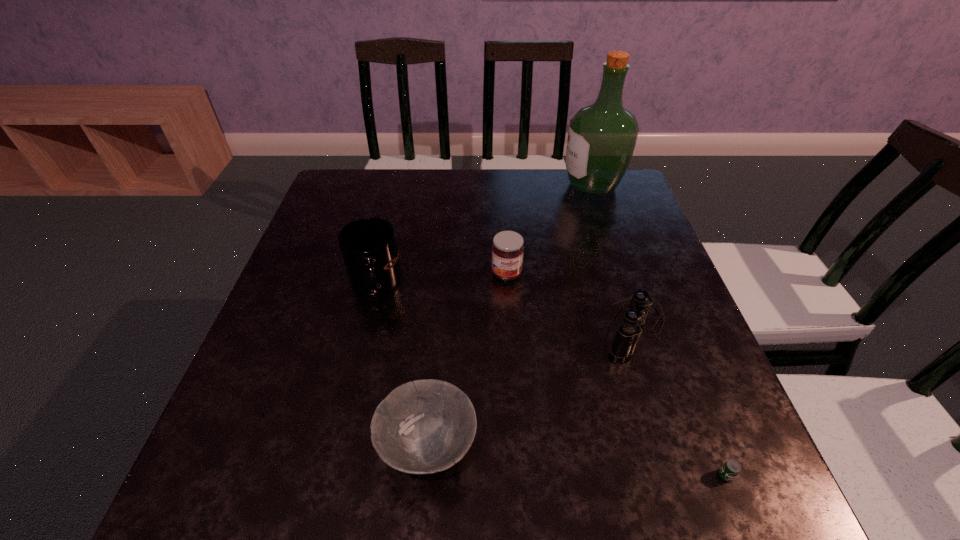
Locate an element on the screen. Image resolution: width=960 pixels, height=540 pixels. object that stands as the fifth closest to the tallest object is located at coordinates (731, 468).

Locate an element on the screen. vacant area in the image that satisfies the following two spatial constraints: 1. on the front-facing side of the tallest object; 2. on the front side of the third object from left to right is located at coordinates pyautogui.click(x=621, y=273).

Identify the location of vacant space that satisfies the following two spatial constraints: 1. with the handle on the side of the fifth shortest object; 2. on the left side of the shortest object. (328, 475).

Locate an element on the screen. This screenshot has width=960, height=540. vacant space that satisfies the following two spatial constraints: 1. on the front side of the fifth tallest object; 2. on the left side of the shortest object is located at coordinates (425, 475).

Where is `vacant region that satisfies the following two spatial constraints: 1. with the handle on the side of the mug; 2. on the left side of the fifth object from right to left`? Image resolution: width=960 pixels, height=540 pixels. vacant region that satisfies the following two spatial constraints: 1. with the handle on the side of the mug; 2. on the left side of the fifth object from right to left is located at coordinates (336, 447).

Image resolution: width=960 pixels, height=540 pixels. I want to click on free space that satisfies the following two spatial constraints: 1. on the front side of the bowl; 2. on the right side of the shortest object, so point(425,475).

Where is `free spot that satisfies the following two spatial constraints: 1. on the front-facing side of the farthest object; 2. on the front side of the jam`? The height and width of the screenshot is (540, 960). free spot that satisfies the following two spatial constraints: 1. on the front-facing side of the farthest object; 2. on the front side of the jam is located at coordinates tap(621, 273).